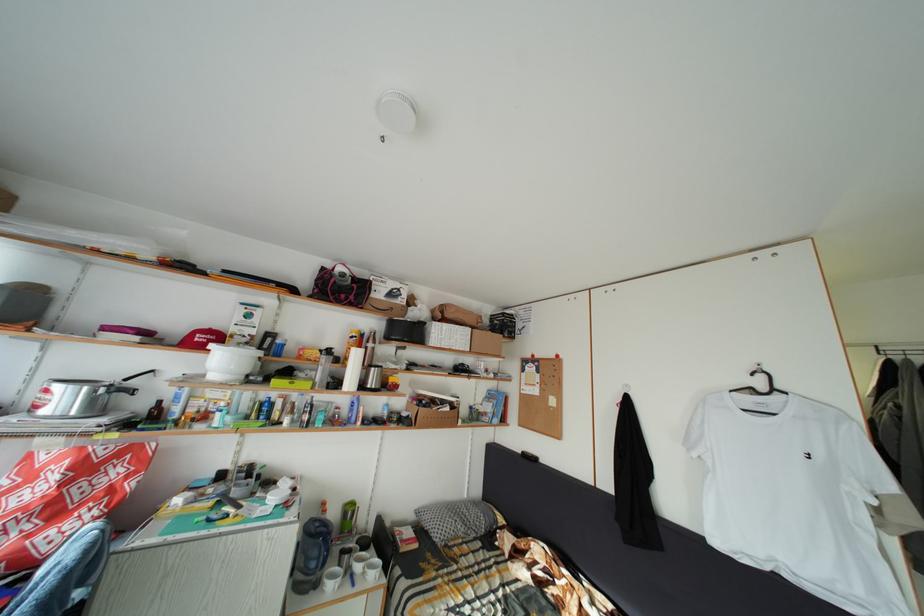
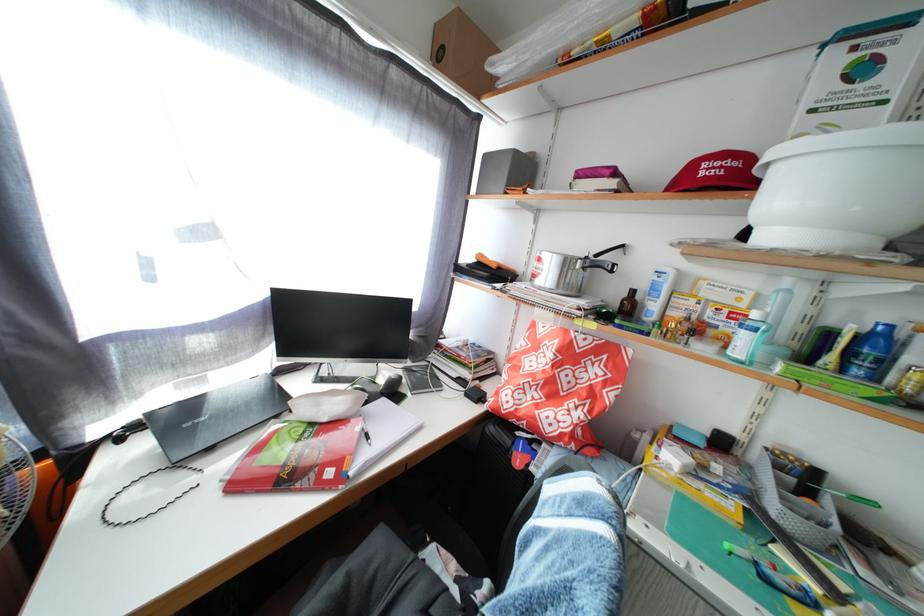
Locate, in the second image, the point that corresponds to point (136, 386) in the first image.

(605, 262)